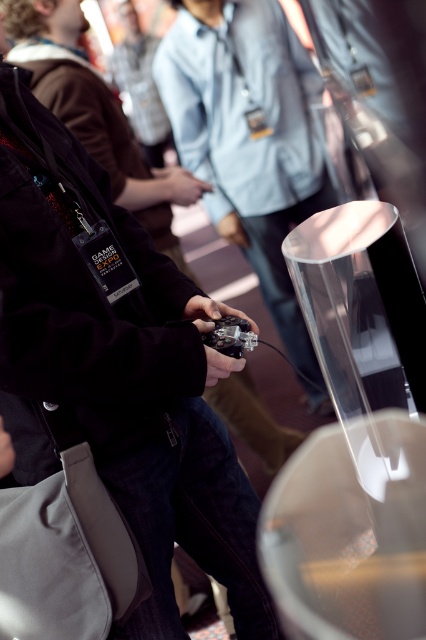
You are at the GAME DESIGN EXPO and need to locate the matte black jacket at center. According to the coordinates provided, where exactly is the matte black jacket positioned?

The matte black jacket at center is located at point coordinates 0.180 on the x axis and 0.225 on the y axis.

You are at the GAME DESIGN EXPO and want to see what the person in the matte black jacket at center is holding. Can you see the metallic black game controller at center from your current position?

The metallic black game controller at center is behind the matte black jacket at center, so you cannot see it from your current position.